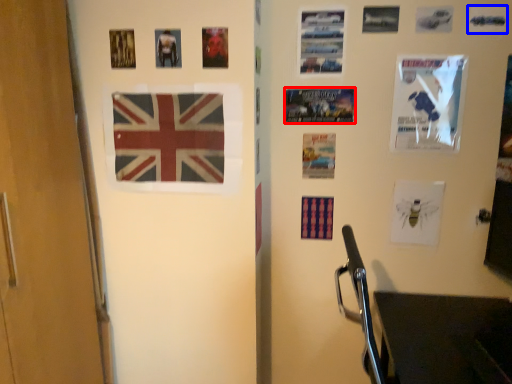
Question: Which object appears closest to the camera in this image, poster page (highlighted by a red box) or poster page (highlighted by a blue box)?

Choices:
 (A) poster page
 (B) poster page

Answer: (B)